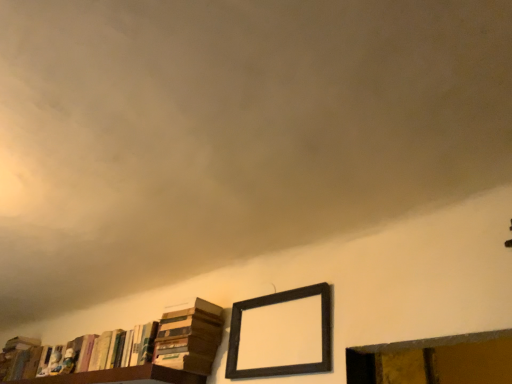
What do you see at coordinates (276, 304) in the screenshot? The width and height of the screenshot is (512, 384). I see `dark wood picture frame at upper center` at bounding box center [276, 304].

At what (x,y) coordinates should I click in order to perform the action: click on dark wood picture frame at upper center. Please return your answer as a coordinate pair (x, y). The width and height of the screenshot is (512, 384). Looking at the image, I should click on (276, 304).

Find the location of a particular element. The height and width of the screenshot is (384, 512). hardcover books at lower left, the 3th book positioned from the left is located at coordinates (189, 336).

Image resolution: width=512 pixels, height=384 pixels. I want to click on hardcover books at lower left, the 2th book viewed from the right, so click(137, 351).

This screenshot has height=384, width=512. Describe the element at coordinates (20, 358) in the screenshot. I see `hardcover book at lower left, which appears as the third book when viewed from the right` at that location.

Measure the distance between hardcover book at lower left, which ranks as the 1th book in left-to-right order, and camera.

The depth of hardcover book at lower left, which ranks as the 1th book in left-to-right order, is 7.72 feet.

Identify the location of wooden window frame at lower right. Image resolution: width=512 pixels, height=384 pixels. (434, 360).

What do you see at coordinates (434, 360) in the screenshot? I see `wooden window frame at lower right` at bounding box center [434, 360].

At what (x,y) coordinates should I click in order to perform the action: click on dark wood picture frame at upper center. Please return your answer as a coordinate pair (x, y). The width and height of the screenshot is (512, 384). Looking at the image, I should click on (276, 304).

In the scene shown: Is dark wood picture frame at upper center touching hardcover book at lower left, which appears as the third book when viewed from the right?

No, dark wood picture frame at upper center is not making contact with hardcover book at lower left, which appears as the third book when viewed from the right.

From the image's perspective, would you say dark wood picture frame at upper center is shown under hardcover book at lower left, which appears as the third book when viewed from the right?

Actually, dark wood picture frame at upper center appears above hardcover book at lower left, which appears as the third book when viewed from the right, in the image.

Considering the sizes of objects dark wood picture frame at upper center and hardcover book at lower left, which ranks as the 1th book in left-to-right order, in the image provided, who is taller, dark wood picture frame at upper center or hardcover book at lower left, which ranks as the 1th book in left-to-right order,?

hardcover book at lower left, which ranks as the 1th book in left-to-right order, is taller.

Can hardcover books at lower left, which is the second book from left to right, be found inside hardcover books at lower left, the 3th book positioned from the left?

No, hardcover books at lower left, the 3th book positioned from the left, does not contain hardcover books at lower left, which is the second book from left to right.

Is hardcover books at lower left, the 3th book positioned from the left, not near hardcover books at lower left, the 2th book viewed from the right?

No.

Does point (207, 375) come in front of point (95, 339)?

Yes, point (207, 375) is in front of point (95, 339).

Is hardcover books at lower left, the 2th book viewed from the right, not inside wooden window frame at lower right?

Yes, hardcover books at lower left, the 2th book viewed from the right, is not within wooden window frame at lower right.

From the image's perspective, which one is positioned higher, hardcover books at lower left, the 2th book viewed from the right, or wooden window frame at lower right?

wooden window frame at lower right is shown above in the image.

Considering the positions of objects dark wood picture frame at upper center and hardcover books at lower left, the 2th book viewed from the right, in the image provided, who is in front, dark wood picture frame at upper center or hardcover books at lower left, the 2th book viewed from the right,?

dark wood picture frame at upper center is in front.

Between dark wood picture frame at upper center and hardcover books at lower left, which is the second book from left to right, which one has smaller size?

dark wood picture frame at upper center is smaller.

Is dark wood picture frame at upper center looking in the opposite direction of hardcover books at lower left, which is the second book from left to right?

That's not correct — dark wood picture frame at upper center is not looking away from hardcover books at lower left, which is the second book from left to right.

Is point (240, 304) closer or farther from the camera than point (219, 315)?

Point (240, 304) is positioned closer to the camera compared to point (219, 315).

What's the angular difference between hardcover books at lower left, which is the second book from left to right, and dark wood picture frame at upper center's facing directions?

There is a 0.00323-degree angle between the facing directions of hardcover books at lower left, which is the second book from left to right, and dark wood picture frame at upper center.

I want to click on book beneath the dark wood picture frame at upper center (from a real-world perspective), so click(137, 351).

Are hardcover books at lower left, which is the second book from left to right, and dark wood picture frame at upper center far apart?

Actually, hardcover books at lower left, which is the second book from left to right, and dark wood picture frame at upper center are a little close together.

Which is further, (202, 333) or (253, 304)?

The point (253, 304) is farther.

From the picture: From the image's perspective, is wooden window frame at lower right beneath hardcover books at lower left, the 2th book viewed from the right?

Incorrect, from the image's perspective, wooden window frame at lower right is higher than hardcover books at lower left, the 2th book viewed from the right.

Based on the photo, is wooden window frame at lower right completely or partially outside of hardcover books at lower left, the 2th book viewed from the right?

Yes, wooden window frame at lower right is outside of hardcover books at lower left, the 2th book viewed from the right.

Does wooden window frame at lower right come behind hardcover books at lower left, which is the second book from left to right?

No, it is in front of hardcover books at lower left, which is the second book from left to right.

Which object is positioned more to the right, wooden window frame at lower right or hardcover books at lower left, the 2th book viewed from the right?

wooden window frame at lower right is more to the right.

From the image's perspective, which object appears higher, hardcover book at lower left, which appears as the third book when viewed from the right, or wooden window frame at lower right?

wooden window frame at lower right appears higher in the image.

Is hardcover book at lower left, which ranks as the 1th book in left-to-right order, positioned beyond the bounds of wooden window frame at lower right?

Indeed, hardcover book at lower left, which ranks as the 1th book in left-to-right order, is completely outside wooden window frame at lower right.

Find the location of a particular element. The height and width of the screenshot is (384, 512). picture frame in front of the hardcover book at lower left, which ranks as the 1th book in left-to-right order is located at coordinates (276, 304).

Image resolution: width=512 pixels, height=384 pixels. There is a hardcover books at lower left, marked as the 1th book in a right-to-left arrangement. Find the location of `the 1st book below it (from the image's perspective)`. the 1st book below it (from the image's perspective) is located at coordinates (137, 351).

Estimate the real-world distances between objects in this image. Which object is further from hardcover books at lower left, the 2th book viewed from the right, wooden window frame at lower right or hardcover books at lower left, the 3th book positioned from the left?

The object further to hardcover books at lower left, the 2th book viewed from the right, is wooden window frame at lower right.

From the image, which object appears to be farther from wooden window frame at lower right, hardcover book at lower left, which ranks as the 1th book in left-to-right order, or hardcover books at lower left, marked as the 1th book in a right-to-left arrangement?

hardcover book at lower left, which ranks as the 1th book in left-to-right order, lies further to wooden window frame at lower right than the other object.

In the scene shown: When comparing their distances from dark wood picture frame at upper center, does hardcover books at lower left, marked as the 1th book in a right-to-left arrangement, or hardcover book at lower left, which appears as the third book when viewed from the right, seem further?

The object further to dark wood picture frame at upper center is hardcover book at lower left, which appears as the third book when viewed from the right.

Looking at the image, which one is located closer to hardcover book at lower left, which appears as the third book when viewed from the right, dark wood picture frame at upper center or hardcover books at lower left, which is the second book from left to right?

The object closer to hardcover book at lower left, which appears as the third book when viewed from the right, is hardcover books at lower left, which is the second book from left to right.

Looking at the image, which one is located further to wooden window frame at lower right, dark wood picture frame at upper center or hardcover books at lower left, which is the second book from left to right?

Result: The object further to wooden window frame at lower right is hardcover books at lower left, which is the second book from left to right.

When comparing their distances from hardcover books at lower left, marked as the 1th book in a right-to-left arrangement, does wooden window frame at lower right or hardcover books at lower left, the 2th book viewed from the right, seem further?

wooden window frame at lower right lies further to hardcover books at lower left, marked as the 1th book in a right-to-left arrangement, than the other object.

Which object lies further to the anchor point hardcover book at lower left, which ranks as the 1th book in left-to-right order, hardcover books at lower left, which is the second book from left to right, or hardcover books at lower left, marked as the 1th book in a right-to-left arrangement?

hardcover books at lower left, marked as the 1th book in a right-to-left arrangement, is positioned further to the anchor hardcover book at lower left, which ranks as the 1th book in left-to-right order.

Looking at the image, which one is located further to hardcover books at lower left, the 2th book viewed from the right, hardcover book at lower left, which appears as the third book when viewed from the right, or wooden window frame at lower right?

wooden window frame at lower right is further to hardcover books at lower left, the 2th book viewed from the right.

Identify the location of picture frame located between hardcover book at lower left, which ranks as the 1th book in left-to-right order, and wooden window frame at lower right in the left-right direction. Image resolution: width=512 pixels, height=384 pixels. (276, 304).

Find the location of `book between hardcover book at lower left, which ranks as the 1th book in left-to-right order, and hardcover books at lower left, marked as the 1th book in a right-to-left arrangement, in the horizontal direction`. book between hardcover book at lower left, which ranks as the 1th book in left-to-right order, and hardcover books at lower left, marked as the 1th book in a right-to-left arrangement, in the horizontal direction is located at coordinates (137, 351).

Find the location of a particular element. The width and height of the screenshot is (512, 384). book between hardcover books at lower left, which is the second book from left to right, and wooden window frame at lower right from left to right is located at coordinates (189, 336).

Locate an element on the screen. picture frame situated between hardcover books at lower left, marked as the 1th book in a right-to-left arrangement, and wooden window frame at lower right from left to right is located at coordinates (276, 304).